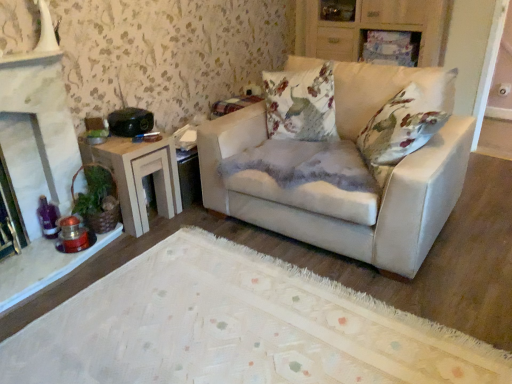
Question: Can you confirm if white stone fireplace at left is bigger than wooden side table at left?

Choices:
 (A) yes
 (B) no

Answer: (A)

Question: Is white stone fireplace at left behind wooden side table at left?

Choices:
 (A) yes
 (B) no

Answer: (B)

Question: From a real-world perspective, does white stone fireplace at left sit lower than wooden side table at left?

Choices:
 (A) yes
 (B) no

Answer: (B)

Question: Can you confirm if white stone fireplace at left is shorter than wooden side table at left?

Choices:
 (A) no
 (B) yes

Answer: (A)

Question: Does white stone fireplace at left lie in front of wooden side table at left?

Choices:
 (A) no
 (B) yes

Answer: (B)

Question: Considering the relative positions of wooden cabinet at upper center and matte white couch at center in the image provided, is wooden cabinet at upper center to the left or to the right of matte white couch at center?

Choices:
 (A) right
 (B) left

Answer: (A)

Question: Is point (313, 54) closer or farther from the camera than point (352, 114)?

Choices:
 (A) farther
 (B) closer

Answer: (A)

Question: Considering the positions of wooden cabinet at upper center and matte white couch at center in the image, is wooden cabinet at upper center bigger or smaller than matte white couch at center?

Choices:
 (A) small
 (B) big

Answer: (A)

Question: Is wooden cabinet at upper center situated inside matte white couch at center or outside?

Choices:
 (A) inside
 (B) outside

Answer: (B)

Question: In terms of height, does matte white couch at center look taller or shorter compared to wooden side table at left?

Choices:
 (A) short
 (B) tall

Answer: (B)

Question: Relative to wooden side table at left, is matte white couch at center in front or behind?

Choices:
 (A) behind
 (B) front

Answer: (B)

Question: From a real-world perspective, is matte white couch at center above or below wooden side table at left?

Choices:
 (A) above
 (B) below

Answer: (A)

Question: Is matte white couch at center spatially inside wooden side table at left, or outside of it?

Choices:
 (A) inside
 (B) outside

Answer: (B)

Question: Choose the correct answer: Is wooden side table at left inside white stone fireplace at left or outside it?

Choices:
 (A) inside
 (B) outside

Answer: (B)

Question: Does point (157, 150) appear closer or farther from the camera than point (12, 72)?

Choices:
 (A) closer
 (B) farther

Answer: (B)